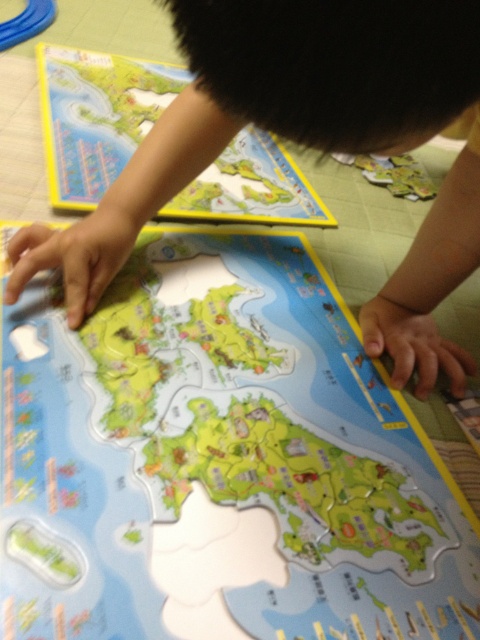
Does point (305, 452) come behind point (460, 81)?

That is True.

Between point (412, 627) and point (132, 177), which one is positioned behind?

Positioned behind is point (132, 177).

Image resolution: width=480 pixels, height=640 pixels. I want to click on light blue plastic map at center, so click(x=218, y=460).

Based on the photo, is light blue plastic map at center to the right of yellow paper map at upper left from the viewer's perspective?

Indeed, light blue plastic map at center is positioned on the right side of yellow paper map at upper left.

Between light blue plastic map at center and yellow paper map at upper left, which one appears on the left side from the viewer's perspective?

Positioned to the left is yellow paper map at upper left.

Find the location of a particular element. The height and width of the screenshot is (640, 480). light blue plastic map at center is located at coordinates (218, 460).

At what (x,y) coordinates should I click in order to perform the action: click on light blue plastic map at center. Please return your answer as a coordinate pair (x, y). This screenshot has height=640, width=480. Looking at the image, I should click on (218, 460).

Who is positioned more to the left, smooth skin at center or yellow paper map at upper left?

yellow paper map at upper left

Find the location of a particular element. The height and width of the screenshot is (640, 480). smooth skin at center is located at coordinates click(x=271, y=108).